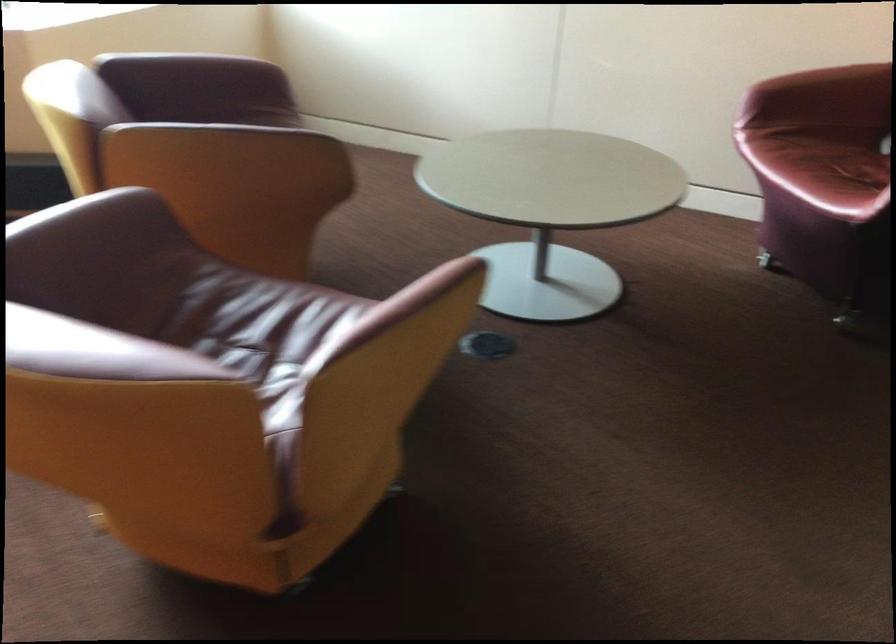
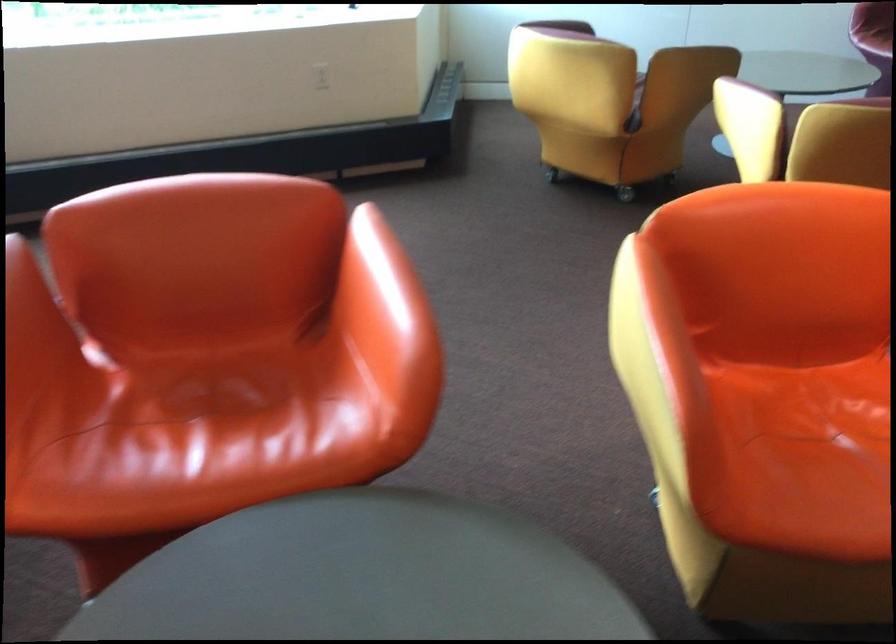
Question: I am providing you with two images of the same scene from different viewpoints. Please identify which objects are invisible in image2.

Choices:
 (A) purple chair sitting surface
 (B) brown chair sitting surface
 (C) yellow chair armrest
 (D) grey handheld device

Answer: (B)